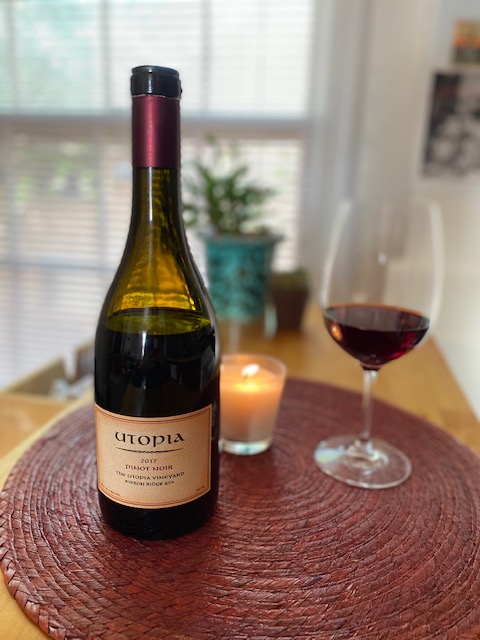
At what (x,y) coordinates should I click in order to perform the action: click on bottle. Please return your answer as a coordinate pair (x, y). The width and height of the screenshot is (480, 640). Looking at the image, I should click on (156, 384).